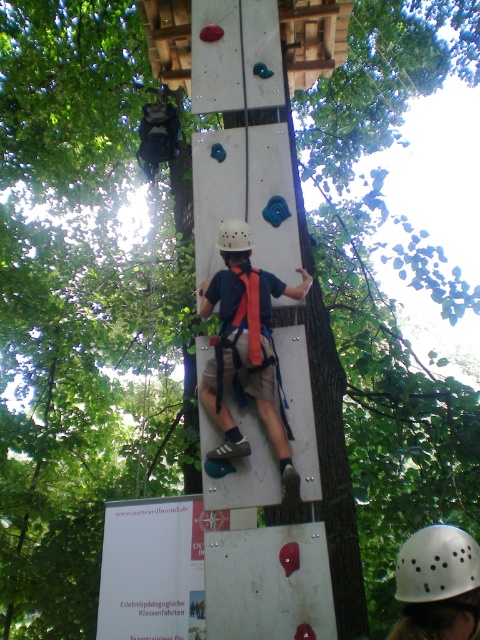
Question: Where is matte orange harness at center located in relation to white matte helmet at lower right in the image?

Choices:
 (A) above
 (B) below

Answer: (A)

Question: Which point appears farthest from the camera in this image?

Choices:
 (A) (224, 257)
 (B) (240, 224)

Answer: (A)

Question: Which point appears farthest from the camera in this image?

Choices:
 (A) (471, 584)
 (B) (241, 221)
 (C) (227, 378)

Answer: (B)

Question: Considering the real-world distances, which object is closest to the white matte helmet at lower right?

Choices:
 (A) matte orange harness at center
 (B) white matte helmet at center

Answer: (A)

Question: Does matte orange harness at center lie behind white matte helmet at center?

Choices:
 (A) no
 (B) yes

Answer: (A)

Question: Does matte orange harness at center have a smaller size compared to white matte helmet at lower right?

Choices:
 (A) no
 (B) yes

Answer: (A)